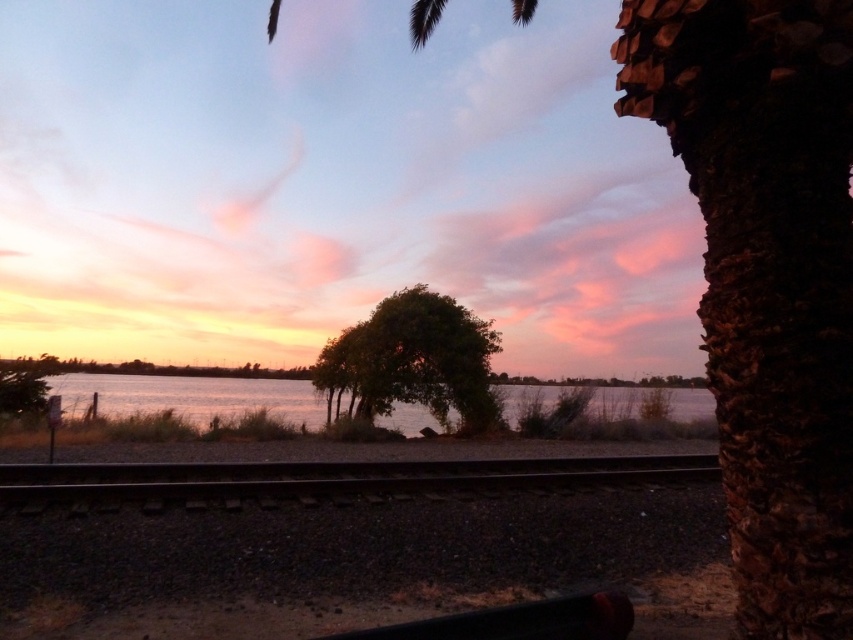
Question: Which object is positioned closest to the green leafy tree at center?

Choices:
 (A) smooth metal train track at center
 (B) silvery reflective water at center

Answer: (B)

Question: Can you confirm if smooth metal train track at center is smaller than green leafy tree at center?

Choices:
 (A) no
 (B) yes

Answer: (A)

Question: Is green leafy tree at center behind silvery reflective water at center?

Choices:
 (A) yes
 (B) no

Answer: (A)

Question: Does smooth metal train track at center lie in front of green leafy tree at center?

Choices:
 (A) no
 (B) yes

Answer: (B)

Question: Which of the following is the farthest from the observer?

Choices:
 (A) silvery reflective water at center
 (B) smooth metal train track at center

Answer: (A)

Question: Which object appears closest to the camera in this image?

Choices:
 (A) smooth metal train track at center
 (B) silvery reflective water at center
 (C) green leafy tree at center

Answer: (A)